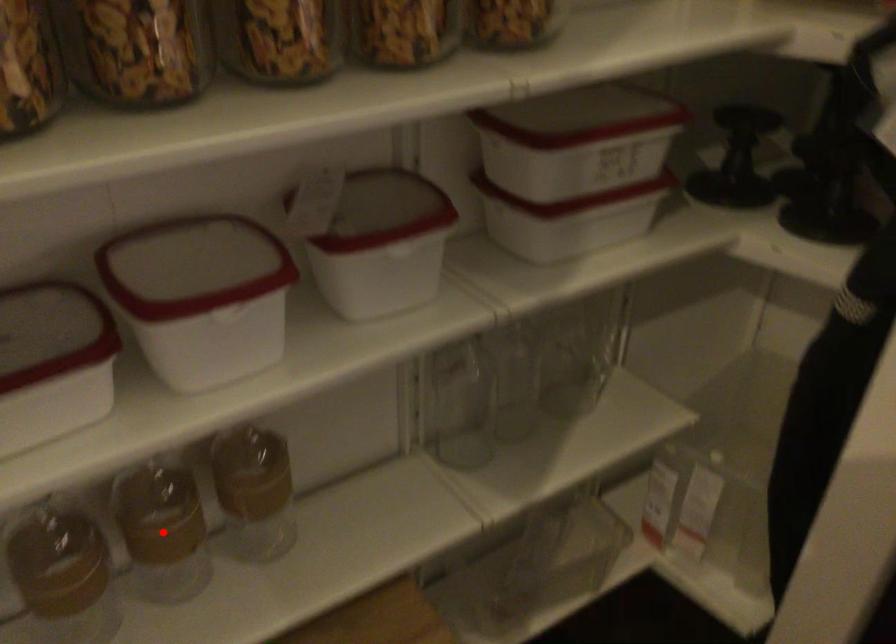
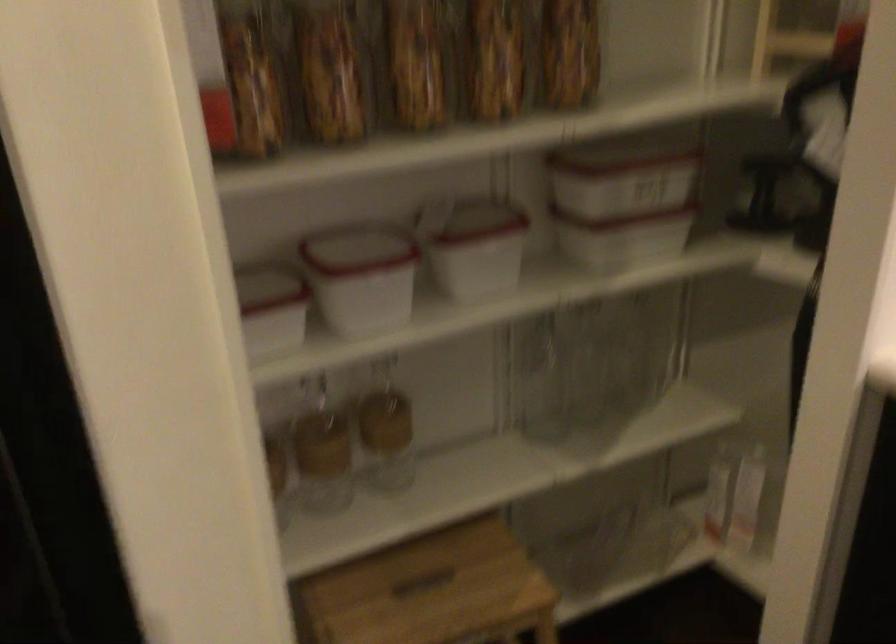
Question: I am providing you with two images of the same scene from different viewpoints. A red point is shown in image1. For the corresponding object point in image2, is it positioned nearer or farther from the camera?

Choices:
 (A) Nearer
 (B) Farther

Answer: (B)